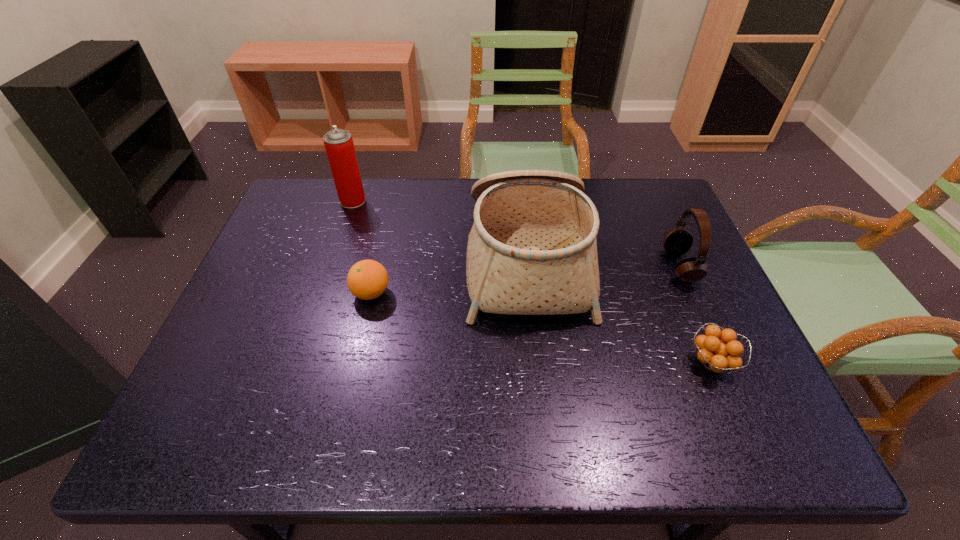
This screenshot has height=540, width=960. What are the coordinates of `free point between the third object from left to right and the leftmost object` in the screenshot? It's located at point(440,230).

Identify the location of empty space between the farther orange fruit and the right orange fruit. This screenshot has height=540, width=960. (541, 328).

This screenshot has width=960, height=540. In order to click on blank region between the basket and the second object from left to right in this screenshot , I will do (x=449, y=276).

You are a GUI agent. You are given a task and a screenshot of the screen. Output one action in this format:
    pyautogui.click(x=<x>, y=<y>)
    Task: Click on the free space between the nearest object and the headset
    This screenshot has height=540, width=960.
    Given the screenshot: What is the action you would take?
    pyautogui.click(x=696, y=314)

Locate an element on the screen. This screenshot has width=960, height=540. vacant area that lies between the basket and the farther orange fruit is located at coordinates (449, 276).

You are a GUI agent. You are given a task and a screenshot of the screen. Output one action in this format:
    pyautogui.click(x=<x>, y=<y>)
    Task: Click on the free area in between the nearer orange fruit and the basket
    This screenshot has width=960, height=540.
    Given the screenshot: What is the action you would take?
    pyautogui.click(x=619, y=311)

Identify the location of vacant point located between the nearer orange fruit and the headset. Image resolution: width=960 pixels, height=540 pixels. (696, 314).

Locate an element on the screen. The image size is (960, 540). object that is the second closest to the farther orange fruit is located at coordinates (339, 146).

I want to click on object that is the second nearest to the fourth object from right to left, so click(x=339, y=146).

The width and height of the screenshot is (960, 540). I want to click on vacant area in the image that satisfies the following two spatial constraints: 1. with the lid open on the nearest object; 2. on the right side of the third object from right to left, so click(x=539, y=362).